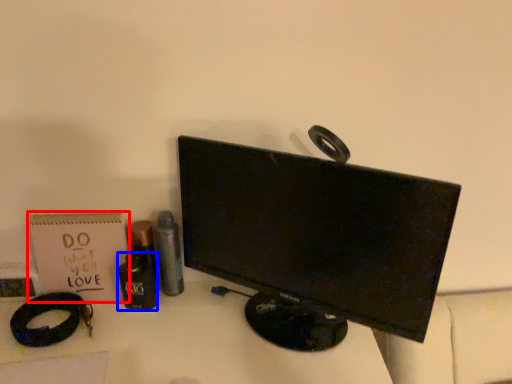
Question: Which object appears closest to the camera in this image, paperback book (highlighted by a red box) or toiletry (highlighted by a blue box)?

Choices:
 (A) paperback book
 (B) toiletry

Answer: (B)